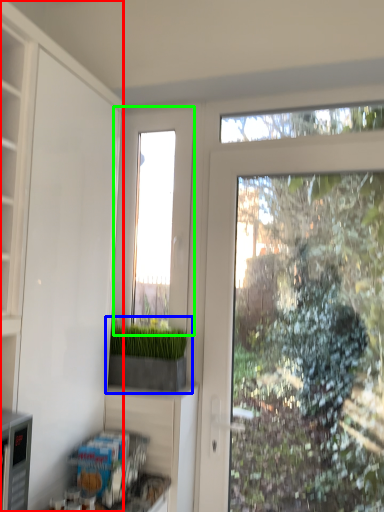
Question: Which object is the farthest from cabinetry (highlighted by a red box)? Choose among these: houseplant (highlighted by a blue box) or window (highlighted by a green box).

Choices:
 (A) houseplant
 (B) window

Answer: (B)